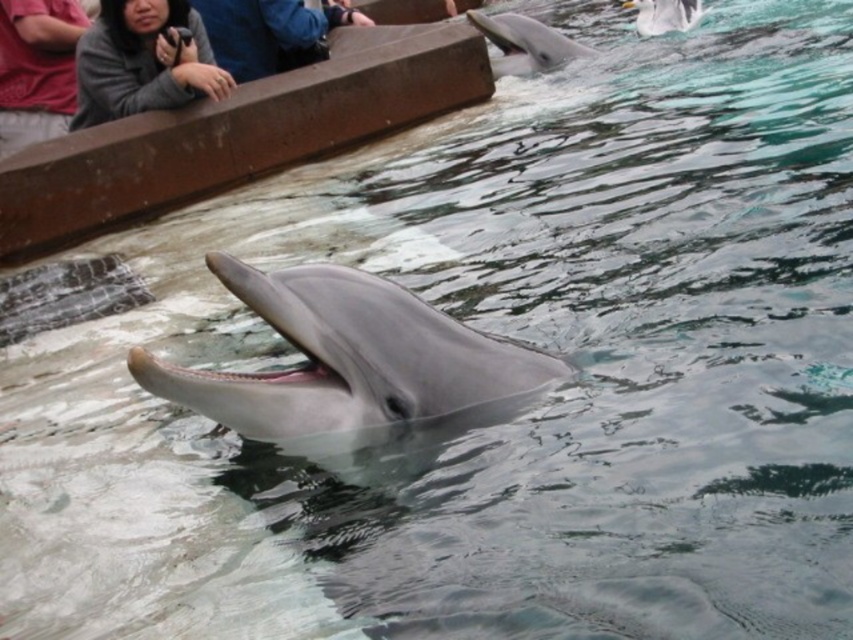
Question: Is blue fabric at upper left positioned behind sleek gray dolphin at upper center?

Choices:
 (A) no
 (B) yes

Answer: (A)

Question: Which object is the closest to the sleek gray dolphin at upper center?

Choices:
 (A) matte gray shirt at upper left
 (B) gray sweater at upper left
 (C) gray smooth dolphin at upper center
 (D) blue fabric at upper left

Answer: (C)

Question: Is blue fabric at upper left to the left of gray smooth dolphin at upper center from the viewer's perspective?

Choices:
 (A) no
 (B) yes

Answer: (B)

Question: Among these points, which one is nearest to the camera?

Choices:
 (A) (506, 16)
 (B) (674, 12)
 (C) (224, 48)

Answer: (C)

Question: Observing the image, what is the correct spatial positioning of sleek gray dolphin at center in reference to matte gray shirt at upper left?

Choices:
 (A) above
 (B) below

Answer: (B)

Question: Among these points, which one is nearest to the camera?

Choices:
 (A) (22, 100)
 (B) (660, 33)
 (C) (442, 332)

Answer: (C)